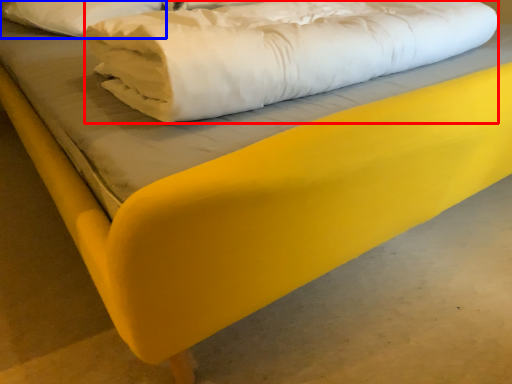
Question: Which object is closer to the camera taking this photo, sheet (highlighted by a red box) or pillow (highlighted by a blue box)?

Choices:
 (A) sheet
 (B) pillow

Answer: (A)